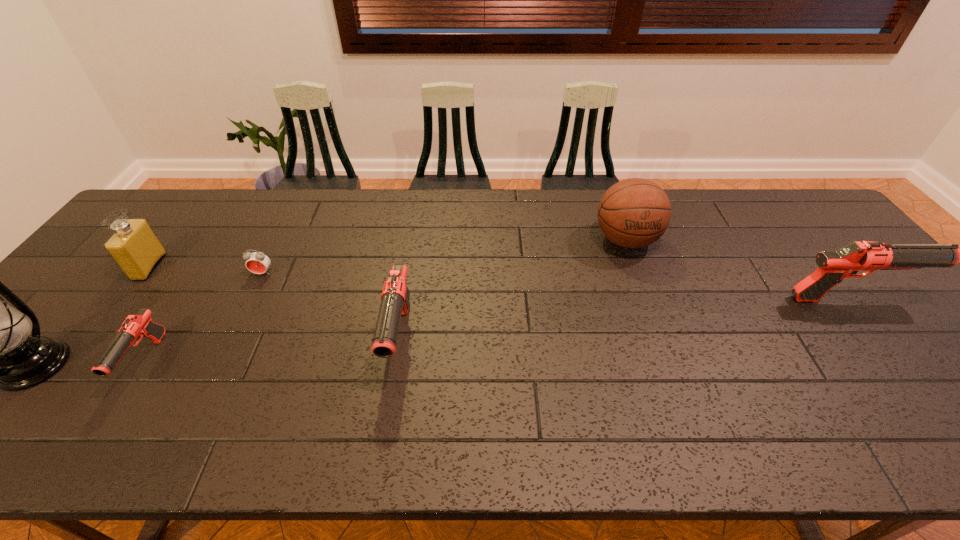
Where is `the shortest gun`? The image size is (960, 540). the shortest gun is located at coordinates (137, 326).

Find the location of `the fifth object from right to left`. the fifth object from right to left is located at coordinates (137, 326).

Where is `the second gun from right to left`? This screenshot has height=540, width=960. the second gun from right to left is located at coordinates (395, 297).

This screenshot has height=540, width=960. I want to click on the third object from right to left, so click(x=395, y=297).

Where is `the rightmost object`? The width and height of the screenshot is (960, 540). the rightmost object is located at coordinates pos(833,266).

In order to click on the fourth object from right to left in this screenshot , I will do `click(257, 262)`.

In order to click on the shortest object in this screenshot , I will do `click(257, 262)`.

Where is `the second object from right to left`? The width and height of the screenshot is (960, 540). the second object from right to left is located at coordinates (633, 213).

Find the location of a particular element. The height and width of the screenshot is (540, 960). perfume is located at coordinates (135, 248).

The height and width of the screenshot is (540, 960). Find the location of `vacant space located on the face of the fourth object from left to right`. vacant space located on the face of the fourth object from left to right is located at coordinates (251, 299).